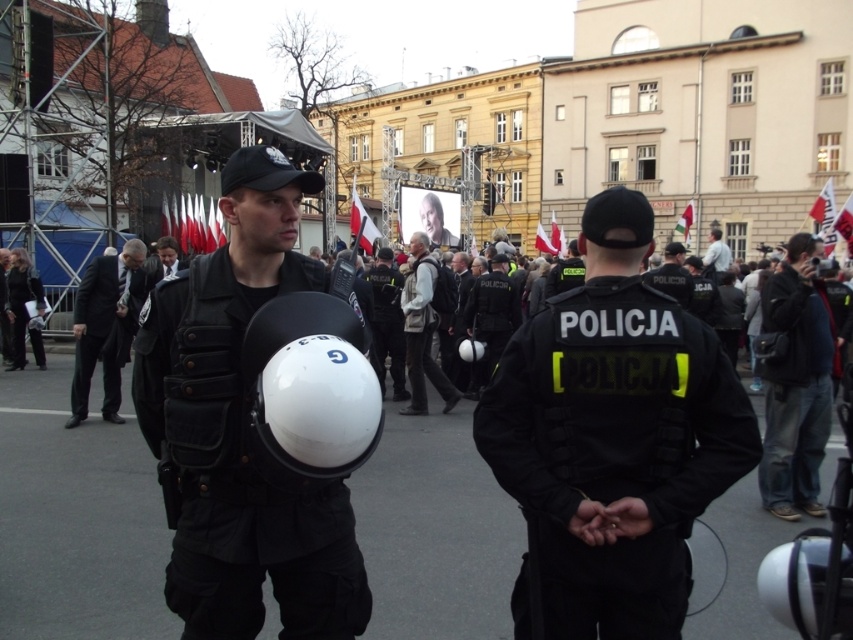
What is the exact location of the dark blue jeans at center in the image?

The dark blue jeans at center is located at point (796, 384).

You are a photographer at the event and want to capture a closeup of the matte black helmet at center and the black tactical vest at center in the same frame. Which object should you focus on first to ensure both are in focus?

The matte black helmet at center might be wider than black tactical vest at center, so focusing on the wider object first would help ensure both are in focus.